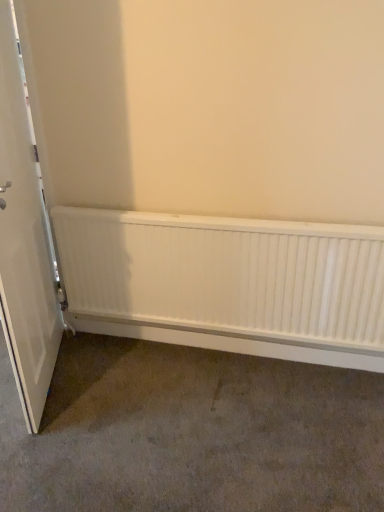
The image size is (384, 512). What do you see at coordinates (24, 242) in the screenshot? I see `white matte door at left` at bounding box center [24, 242].

Locate an element on the screen. The image size is (384, 512). white matte door at left is located at coordinates (24, 242).

Find the location of `white matte radiator at lower center`. white matte radiator at lower center is located at coordinates (227, 274).

What do you see at coordinates (227, 274) in the screenshot? I see `white matte radiator at lower center` at bounding box center [227, 274].

Locate an element on the screen. This screenshot has height=512, width=384. white matte door at left is located at coordinates (24, 242).

Between white matte door at left and white matte radiator at lower center, which one appears on the right side from the viewer's perspective?

white matte radiator at lower center is more to the right.

Which object is more forward, white matte door at left or white matte radiator at lower center?

white matte door at left is closer to the camera.

Considering the points (43, 290) and (103, 210), which point is behind, point (43, 290) or point (103, 210)?

The point (103, 210) is farther.

From the image's perspective, is white matte door at left positioned above or below white matte radiator at lower center?

white matte door at left is situated higher than white matte radiator at lower center in the image.

From a real-world perspective, which object rests below the other?

white matte radiator at lower center, from a real-world perspective.

Consider the image. Considering the relative sizes of white matte door at left and white matte radiator at lower center in the image provided, is white matte door at left thinner than white matte radiator at lower center?

No.

Does white matte door at left have a lesser height compared to white matte radiator at lower center?

In fact, white matte door at left may be taller than white matte radiator at lower center.

Is white matte door at left bigger than white matte radiator at lower center?

Indeed, white matte door at left has a larger size compared to white matte radiator at lower center.

Can white matte radiator at lower center be found inside white matte door at left?

No.

Is white matte door at left positioned far away from white matte radiator at lower center?

Actually, white matte door at left and white matte radiator at lower center are a little close together.

Is white matte door at left facing away from white matte radiator at lower center?

Yes.

How different are the orientations of white matte door at left and white matte radiator at lower center in degrees?

68.6 degrees separate the facing orientations of white matte door at left and white matte radiator at lower center.

Image resolution: width=384 pixels, height=512 pixels. Identify the location of door above the white matte radiator at lower center (from a real-world perspective). (24, 242).

Is white matte radiator at lower center to the left or to the right of white matte door at left in the image?

white matte radiator at lower center is to the right of white matte door at left.

Is white matte radiator at lower center in front of white matte door at left?

No, white matte radiator at lower center is behind white matte door at left.

Is point (134, 227) closer or farther from the camera than point (0, 200)?

Point (134, 227) is positioned farther from the camera compared to point (0, 200).

From the image's perspective, is white matte radiator at lower center positioned above or below white matte door at left?

Clearly, from the image's perspective, white matte radiator at lower center is below white matte door at left.

From a real-world perspective, is white matte radiator at lower center positioned above or below white matte door at left?

In terms of real-world spatial position, white matte radiator at lower center is below white matte door at left.

Looking at their sizes, would you say white matte radiator at lower center is wider or thinner than white matte door at left?

white matte radiator at lower center is thinner than white matte door at left.

Between white matte radiator at lower center and white matte door at left, which one has less height?

white matte radiator at lower center.

Considering the sizes of objects white matte radiator at lower center and white matte door at left in the image provided, who is bigger, white matte radiator at lower center or white matte door at left?

white matte door at left is bigger.

Is white matte door at left inside white matte radiator at lower center?

No, white matte door at left is not surrounded by white matte radiator at lower center.

Are white matte radiator at lower center and white matte door at left located far from each other?

white matte radiator at lower center is near white matte door at left, not far away.

Is white matte radiator at lower center oriented towards white matte door at left?

Yes, white matte radiator at lower center is oriented towards white matte door at left.

In the image, there is a white matte door at left. At what (x,y) coordinates should I click in order to perform the action: click on radiator below it (from the image's perspective). Please return your answer as a coordinate pair (x, y). The width and height of the screenshot is (384, 512). Looking at the image, I should click on (227, 274).

I want to click on radiator on the right side of white matte door at left, so click(x=227, y=274).

Where is `door on the left of white matte radiator at lower center`? door on the left of white matte radiator at lower center is located at coordinates (24, 242).